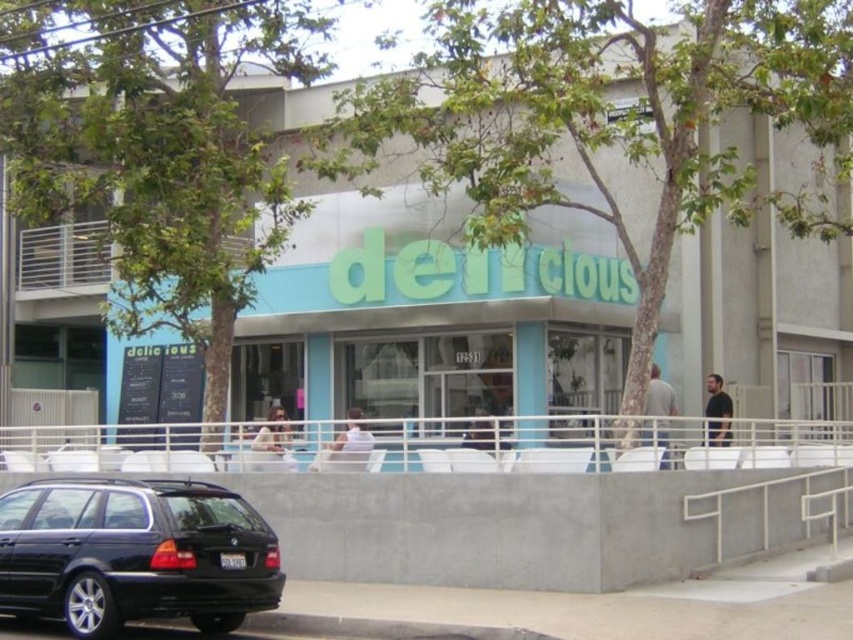
You are standing at the entrance of the building and want to take a photo of the black matte wagon at lower left. Which direction should you face to capture it in your shot?

To capture the black matte wagon at lower left, you should face towards the lower left direction from the entrance since that is where the wagon is located.